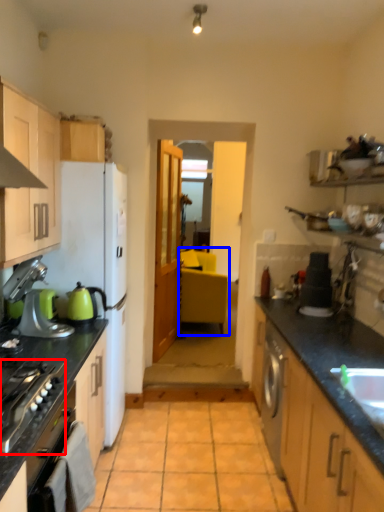
Question: Which object appears closest to the camera in this image, home appliance (highlighted by a red box) or chair (highlighted by a blue box)?

Choices:
 (A) home appliance
 (B) chair

Answer: (A)